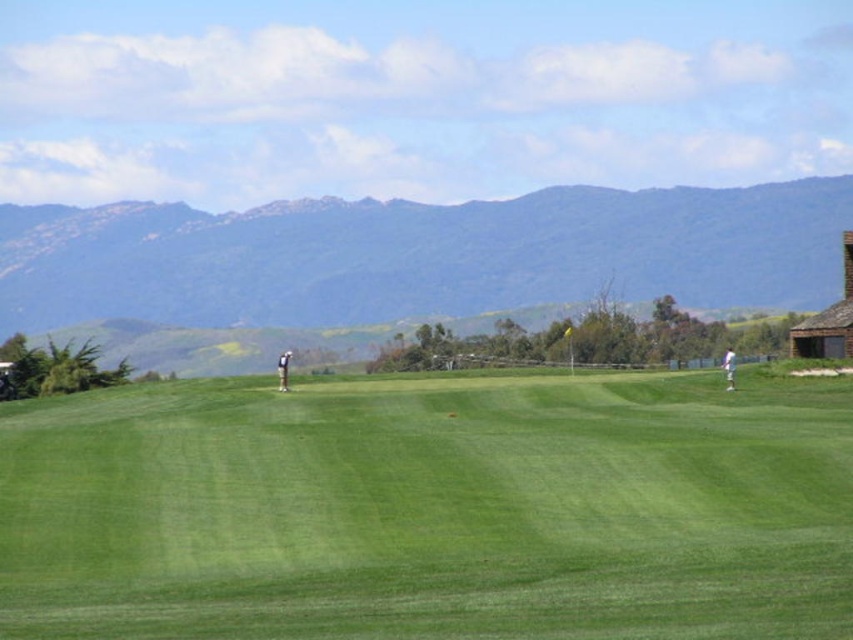
Question: Among these points, which one is farthest from the camera?

Choices:
 (A) (285, 362)
 (B) (320, 257)
 (C) (136, 458)

Answer: (B)

Question: Which of the following is the closest to the observer?

Choices:
 (A) white cotton shirt at right
 (B) green forested mountain at upper center

Answer: (A)

Question: Is green forested mountain at upper center below white cotton shirt at right?

Choices:
 (A) yes
 (B) no

Answer: (B)

Question: From the image, what is the correct spatial relationship of green grassy field at center in relation to white cotton shirt at right?

Choices:
 (A) right
 (B) left

Answer: (B)

Question: Which object is farther from the camera taking this photo?

Choices:
 (A) white fabric shirt at center
 (B) white cotton shirt at right

Answer: (A)

Question: Is the position of green grassy field at center less distant than that of white fabric shirt at center?

Choices:
 (A) no
 (B) yes

Answer: (B)